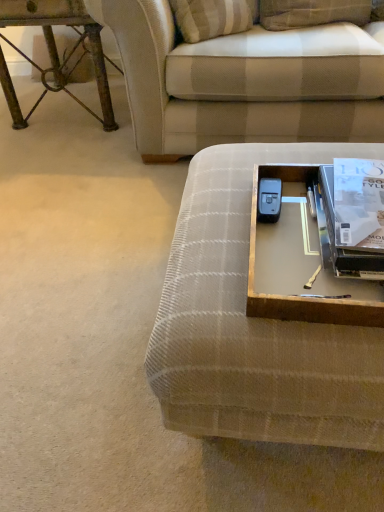
Find the location of `free spot above plaid fabric studio couch at center, the second studio couch in the top-to-bottom sequence (from a real-world perspective)`. free spot above plaid fabric studio couch at center, the second studio couch in the top-to-bottom sequence (from a real-world perspective) is located at coordinates coord(272,219).